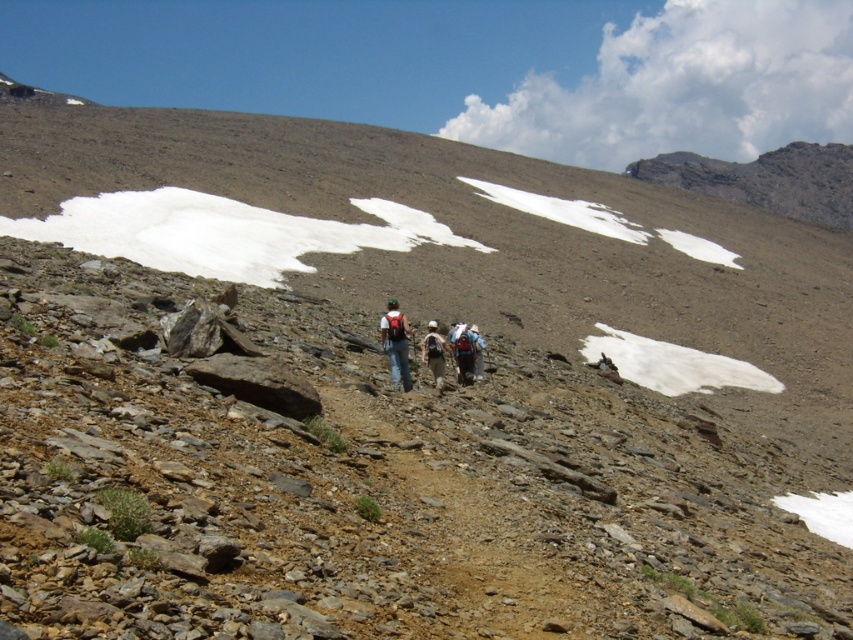
From the picture: You are a hiker trying to place a 10 feet long tent between the matte blue jeans at center and the matte gray backpack at center. Can you fit the tent between them without overlapping either item?

The distance between the matte blue jeans at center and the matte gray backpack at center is 12.66 feet. Since the tent is 10 feet long, there is enough space to place it between them without overlapping either item.

You are a hiker trying to decide which backpack to take from the two at center. The blue fabric backpack at center and the matte white backpack at center. Since you want the one that is easier to reach, which one should you choose?

The blue fabric backpack at center is located below matte white backpack at center, so the matte white backpack at center is higher and might be harder to reach. Therefore, the blue fabric backpack at center would be easier to access.